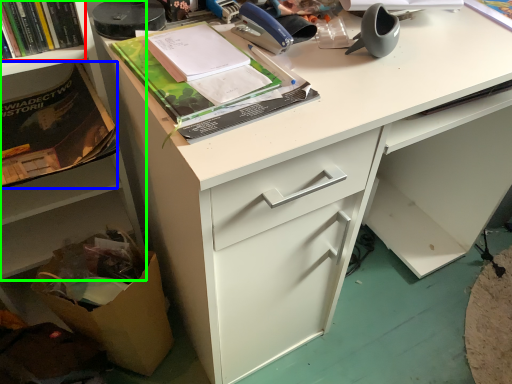
Question: Which object is positioned closest to book (highlighted by a red box)? Select from paperback book (highlighted by a blue box) and cabinetry (highlighted by a green box).

Choices:
 (A) paperback book
 (B) cabinetry

Answer: (A)